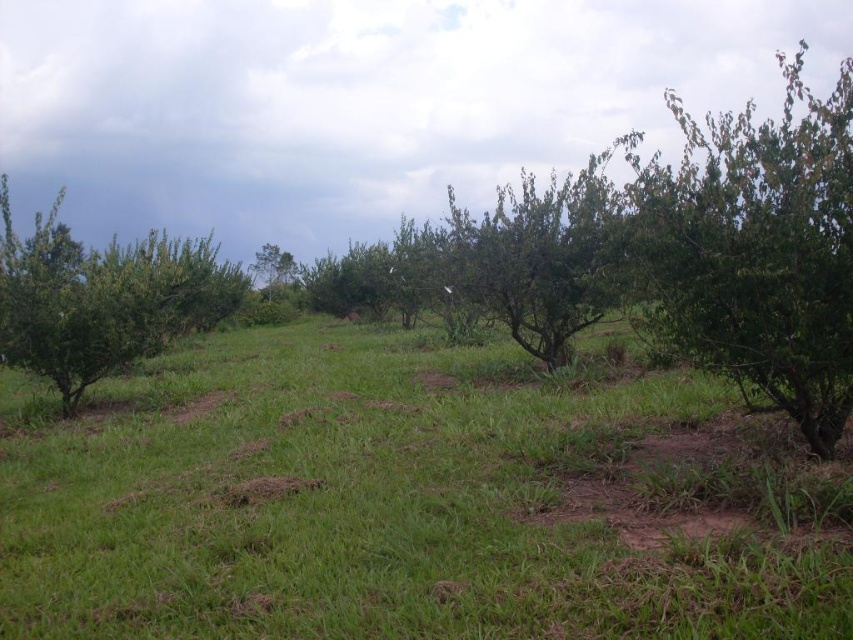
You are standing at point A and want to walk to point B in the rural landscape. The coordinates of point A are point (x=453, y=566) and point B are point (x=161, y=324). According to the image, which direction should you head to reach point B?

Since point (x=453, y=566) is in front of point (x=161, y=324), you should move backward to reach point B from point A.

Looking at this image, you are standing in the rural landscape and want to walk towards the green leafy tree at right. Which direction should you move relative to the green grassy at center?

Since the green grassy at center is closer to the viewer than the green leafy tree at right, you should move away from the green grassy at center to reach the green leafy tree at right.